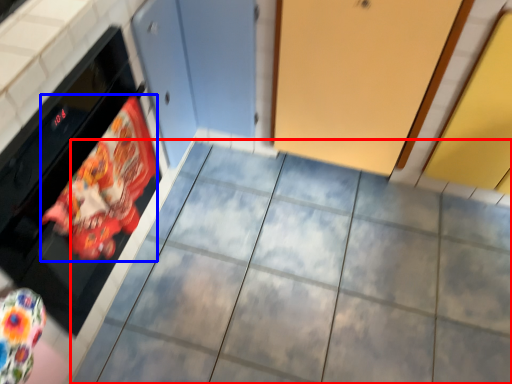
Question: Which of the following is the farthest to the observer, ceramic tile (highlighted by a red box) or material (highlighted by a blue box)?

Choices:
 (A) ceramic tile
 (B) material

Answer: (A)